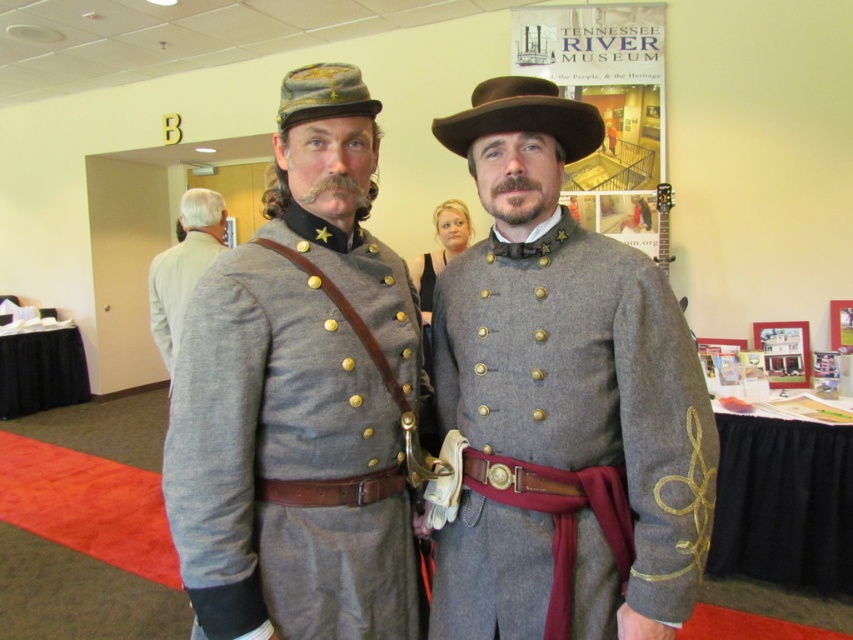
You are a photographer planning to take a portrait of the two individuals wearing the gray wool uniforms at center and the brown felt cowboy hat at center. If you want to ensure both the uniforms and the hat are clearly visible in the frame, which object should you prioritize focusing on and why?

You should prioritize focusing on the gray wool uniforms at center because their width is larger than the brown felt cowboy hat at center, making them more prominent in the frame.